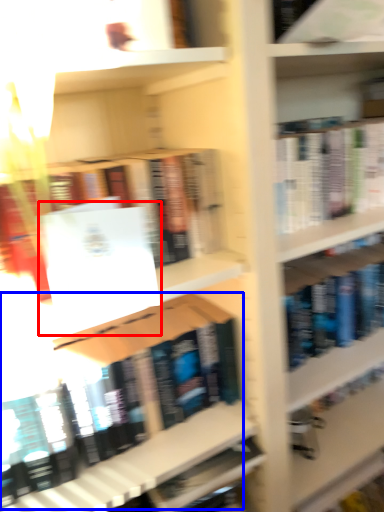
Question: Among these objects, which one is nearest to the camera, paperback book (highlighted by a red box) or book (highlighted by a blue box)?

Choices:
 (A) paperback book
 (B) book

Answer: (A)